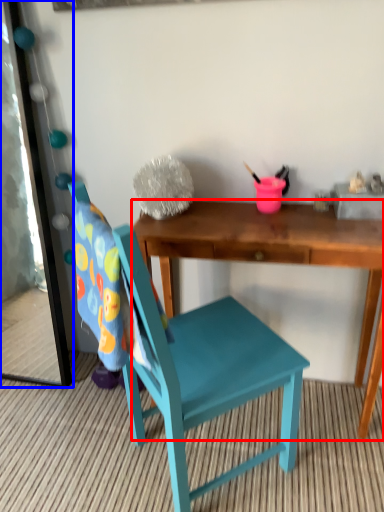
Question: Among these objects, which one is farthest to the camera, desk (highlighted by a red box) or mirror (highlighted by a blue box)?

Choices:
 (A) desk
 (B) mirror

Answer: (B)